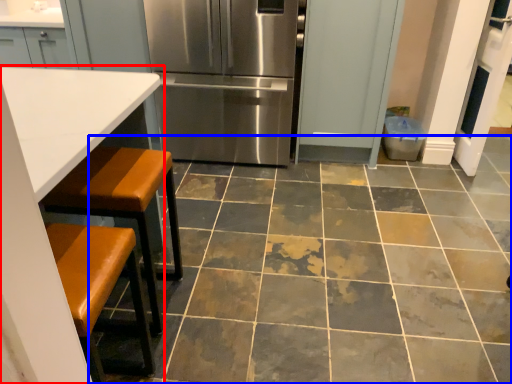
Question: Which point is closer to the camera, table (highlighted by a red box) or ceramic tile (highlighted by a blue box)?

Choices:
 (A) table
 (B) ceramic tile

Answer: (A)